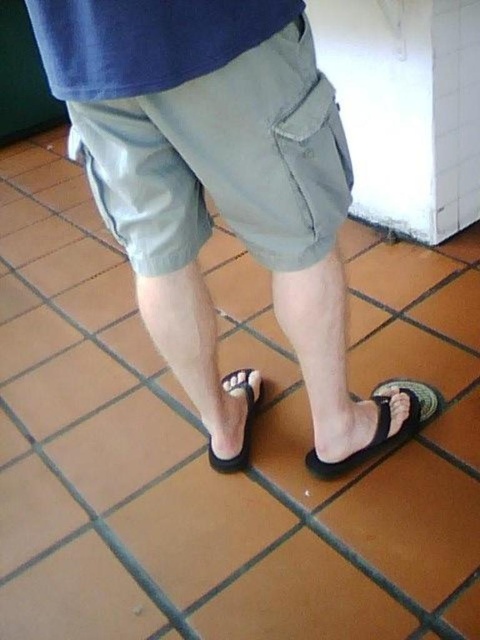
Is black rubber sandal at lower right further to camera compared to black rubber flip-flop at center?

That is False.

Who is higher up, black rubber sandal at lower right or black rubber flip-flop at center?

black rubber flip-flop at center is higher up.

This screenshot has height=640, width=480. What do you see at coordinates (384, 426) in the screenshot?
I see `black rubber sandal at lower right` at bounding box center [384, 426].

This screenshot has width=480, height=640. I want to click on black rubber sandal at lower right, so coord(384,426).

Does matte khaki shorts at center lie behind black rubber sandal at lower right?

No.

Is the position of matte khaki shorts at center less distant than that of black rubber sandal at lower right?

Yes.

Locate an element on the screen. matte khaki shorts at center is located at coordinates 223,189.

Where is `matte khaki shorts at center`? matte khaki shorts at center is located at coordinates (223, 189).

Who is taller, matte khaki shorts at center or black rubber flip-flop at center?

matte khaki shorts at center

Which is in front, point (295, 227) or point (244, 435)?

Point (295, 227)

Locate an element on the screen. The width and height of the screenshot is (480, 640). matte khaki shorts at center is located at coordinates (223, 189).